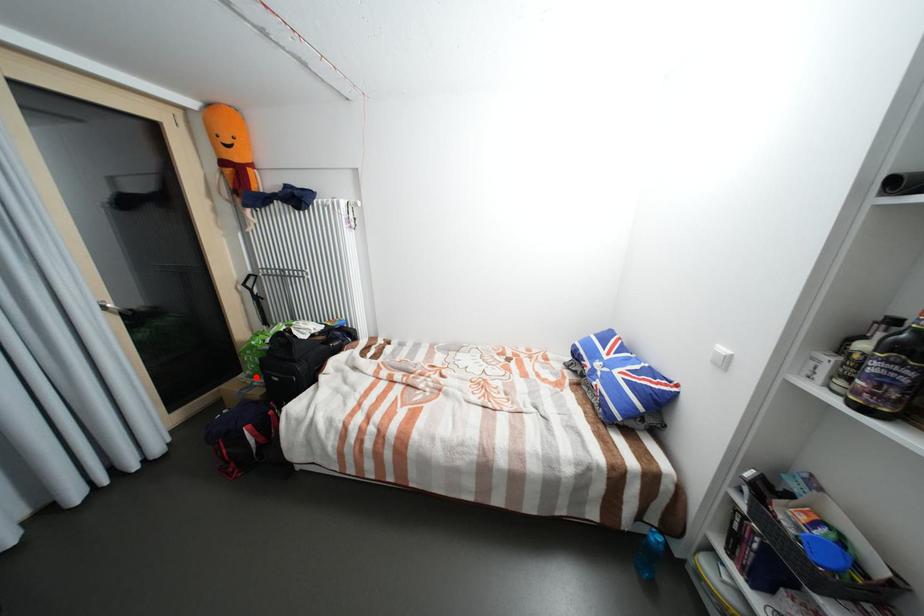
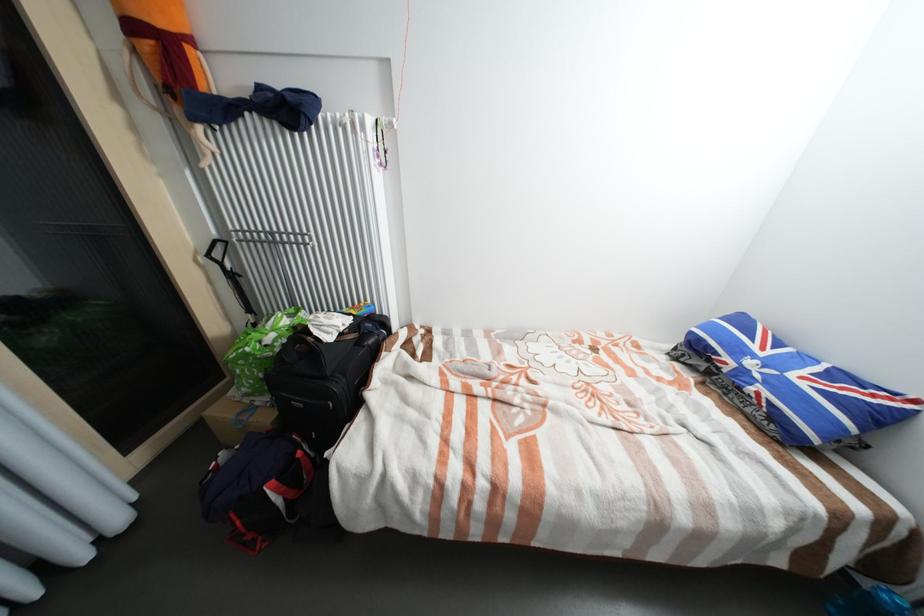
Question: A red point is marked in image1. In image2, is the corresponding 3D point closer to the camera or farther? Reply with the corresponding letter.

Choices:
 (A) The corresponding 3D point is closer.
 (B) The corresponding 3D point is farther.

Answer: (A)